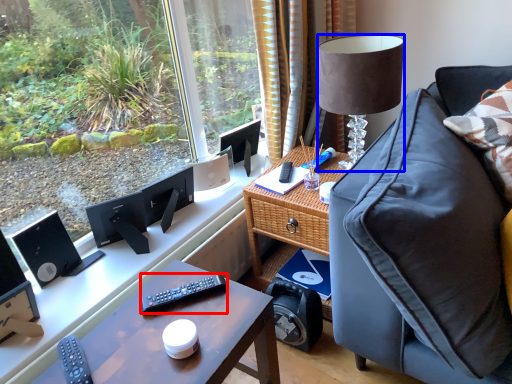
Question: Which of the following is the farthest to the observer, remote control (highlighted by a red box) or lamp (highlighted by a blue box)?

Choices:
 (A) remote control
 (B) lamp

Answer: (B)